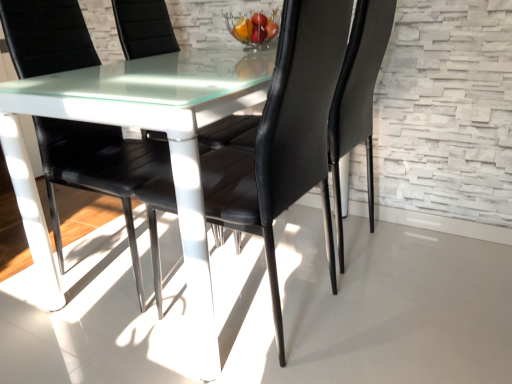
Where is `unoccupied area in front of black leather chair at center, the first chair viewed from the right`? Image resolution: width=512 pixels, height=384 pixels. unoccupied area in front of black leather chair at center, the first chair viewed from the right is located at coordinates (383, 306).